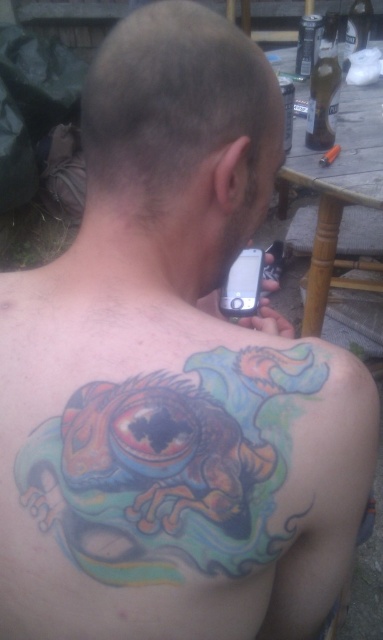
Does colorful tattoo at upper back have a lesser width compared to shiny hair at upper center?

No, colorful tattoo at upper back is not thinner than shiny hair at upper center.

Can you confirm if colorful tattoo at upper back is positioned to the left of shiny hair at upper center?

Incorrect, colorful tattoo at upper back is not on the left side of shiny hair at upper center.

Locate an element on the screen. colorful tattoo at upper back is located at coordinates (171, 467).

Where is `colorful tattoo at upper back`? colorful tattoo at upper back is located at coordinates (171, 467).